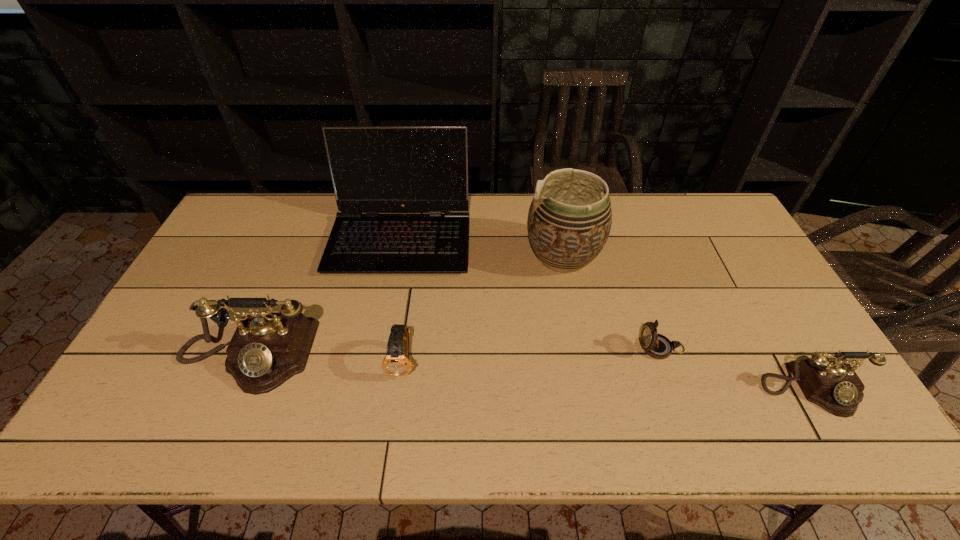
Image resolution: width=960 pixels, height=540 pixels. In order to click on free spot that satisfies the following two spatial constraints: 1. on the face of the compass; 2. on the dial of the taller telephone in this screenshot , I will do `click(664, 355)`.

Where is `free spot that satisfies the following two spatial constraints: 1. on the face of the compass; 2. on the dial of the fourth shortest object`? Image resolution: width=960 pixels, height=540 pixels. free spot that satisfies the following two spatial constraints: 1. on the face of the compass; 2. on the dial of the fourth shortest object is located at coordinates (664, 355).